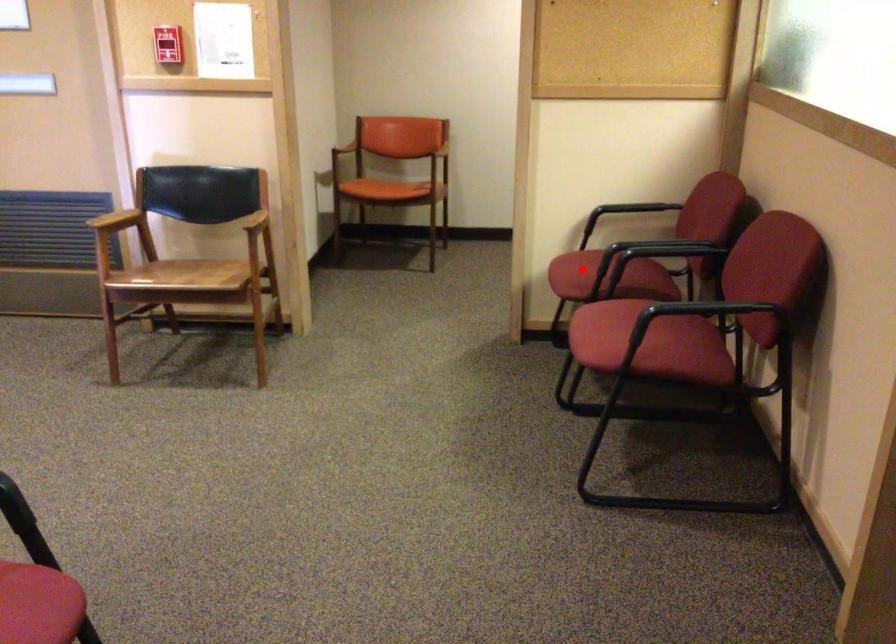
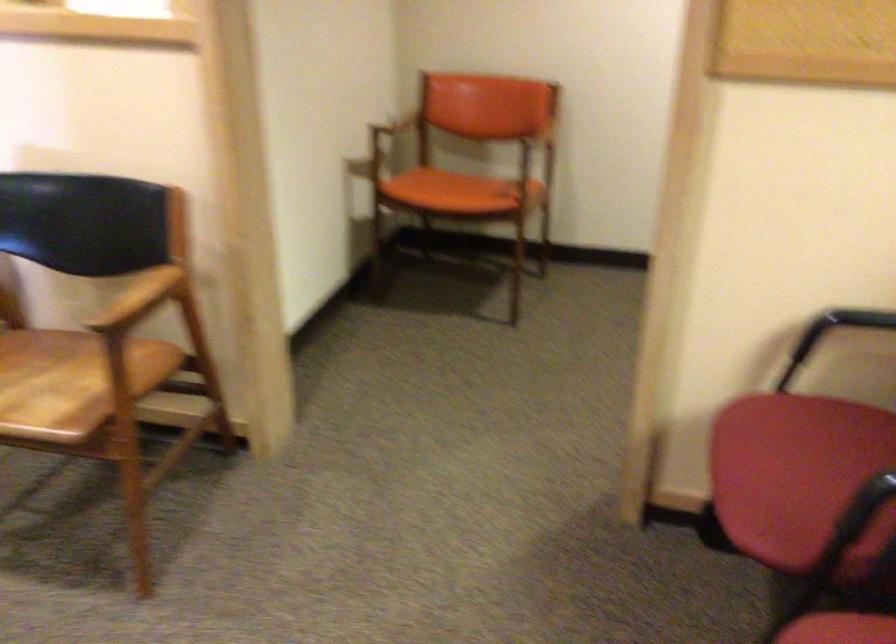
Question: I am providing you with two images of the same scene from different viewpoints. Image1 has a red point marked. In image2, the corresponding 3D location appears at what relative position? Reply with the corresponding letter.

Choices:
 (A) Closer
 (B) Farther

Answer: (A)